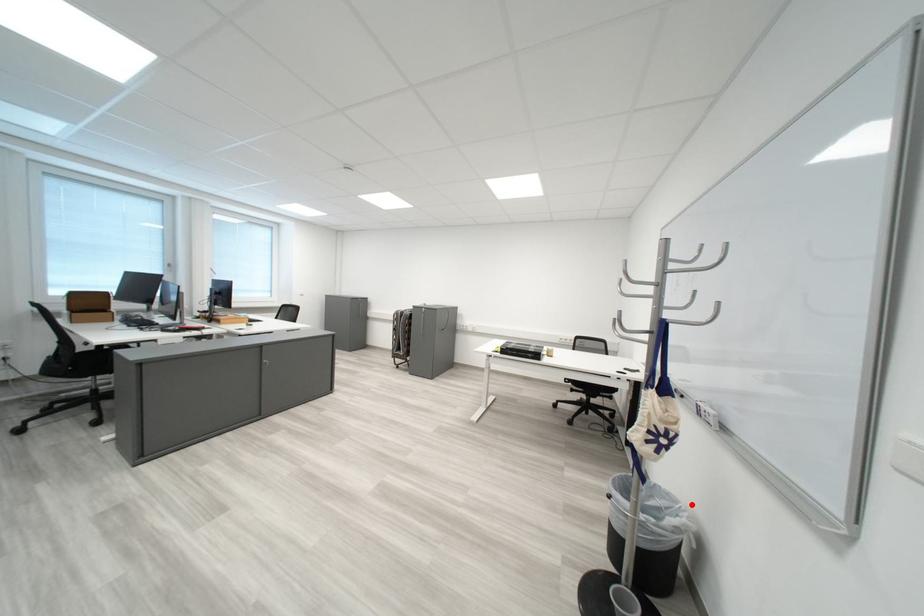
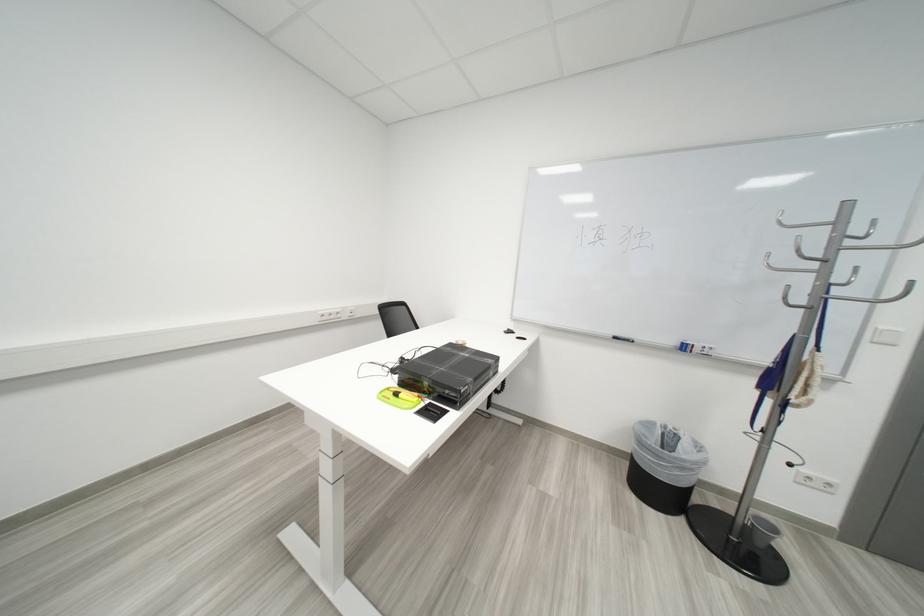
Find the pixel in the second image that matches the highlighted location in the first image.

(666, 424)